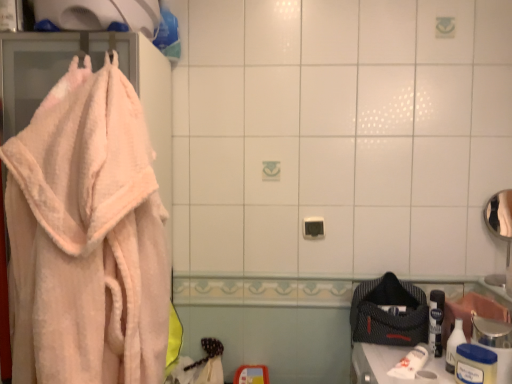
Question: Is white plastic container at lower right, the 2th toiletry from the back, a part of white plastic bottle at lower right, which is the 2th toiletry from front to back?

Choices:
 (A) no
 (B) yes

Answer: (A)

Question: Does white plastic bottle at lower right, which is the 2th toiletry from front to back, have a larger size compared to white plastic container at lower right, which is the first toiletry from front to back?

Choices:
 (A) no
 (B) yes

Answer: (A)

Question: Is white plastic bottle at lower right, the 1th toiletry when ordered from back to front, in contact with white plastic container at lower right, which is the first toiletry from front to back?

Choices:
 (A) yes
 (B) no

Answer: (A)

Question: Is white plastic bottle at lower right, the 1th toiletry when ordered from back to front, to the left of white plastic container at lower right, which is the first toiletry from front to back, from the viewer's perspective?

Choices:
 (A) no
 (B) yes

Answer: (B)

Question: From the image's perspective, would you say white plastic bottle at lower right, which is the 2th toiletry from front to back, is shown under white plastic container at lower right, which is the first toiletry from front to back?

Choices:
 (A) yes
 (B) no

Answer: (B)

Question: Is point (452, 340) positioned closer to the camera than point (470, 362)?

Choices:
 (A) farther
 (B) closer

Answer: (A)

Question: Do you think white plastic bottle at lower right, which is the 2th toiletry from front to back, is within white plastic container at lower right, which is the first toiletry from front to back, or outside of it?

Choices:
 (A) inside
 (B) outside

Answer: (B)

Question: From the image's perspective, relative to white plastic container at lower right, the 2th toiletry from the back, is white plastic bottle at lower right, the 1th toiletry when ordered from back to front, above or below?

Choices:
 (A) above
 (B) below

Answer: (A)

Question: Visually, is white plastic bottle at lower right, which is the 2th toiletry from front to back, positioned to the left or to the right of white plastic container at lower right, which is the first toiletry from front to back?

Choices:
 (A) left
 (B) right

Answer: (A)

Question: Is peachy soft towel at left in front of or behind white plastic bottle at lower right, the 1th toiletry when ordered from back to front, in the image?

Choices:
 (A) front
 (B) behind

Answer: (A)

Question: From the image's perspective, is peachy soft towel at left positioned above or below white plastic bottle at lower right, which is the 2th toiletry from front to back?

Choices:
 (A) above
 (B) below

Answer: (A)

Question: In terms of width, does peachy soft towel at left look wider or thinner when compared to white plastic bottle at lower right, the 1th toiletry when ordered from back to front?

Choices:
 (A) wide
 (B) thin

Answer: (A)

Question: Considering the positions of point (32, 213) and point (445, 360), is point (32, 213) closer or farther from the camera than point (445, 360)?

Choices:
 (A) farther
 (B) closer

Answer: (B)

Question: From the image's perspective, relative to white plastic container at lower right, which is the first toiletry from front to back, is peachy soft towel at left above or below?

Choices:
 (A) below
 (B) above

Answer: (B)

Question: Relative to white plastic container at lower right, which is the first toiletry from front to back, is peachy soft towel at left in front or behind?

Choices:
 (A) front
 (B) behind

Answer: (A)